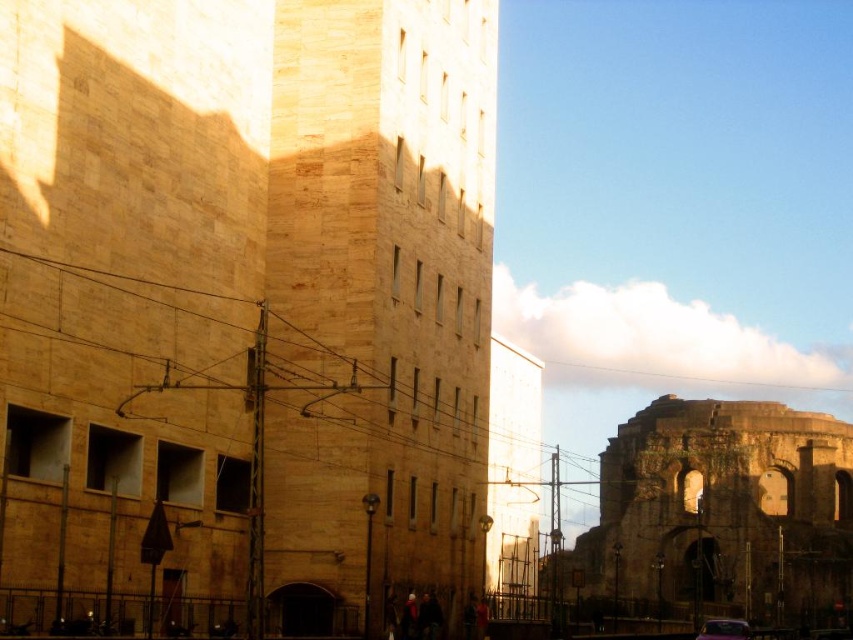
You are a photographer wanting to capture the brown stone ruins at right without the metallic purple car at lower right blocking the view. Based on the scene, can you determine if the car is in front of or behind the ruins?

The brown stone ruins at right is positioned under metallic purple car at lower right, meaning the car is in front of the ruins, blocking the view.

You are a drone operator trying to capture a photo of the brown stone ruins at right. The drone is currently hovering at point 0.5, 0.5. Which direction should you move the drone to get closer to the ruins?

The brown stone ruins at right is located at point (721, 513), so you should move the drone towards the upper right direction to get closer to the ruins.

You are standing in front of the image and want to determine which of the two points, point (267, 545) or point (635, 522), is nearer to you. Based on the scene description, can you identify the closer point?

Point (267, 545) is closer to the camera than point (635, 522), so the closer point to you is point (267, 545).